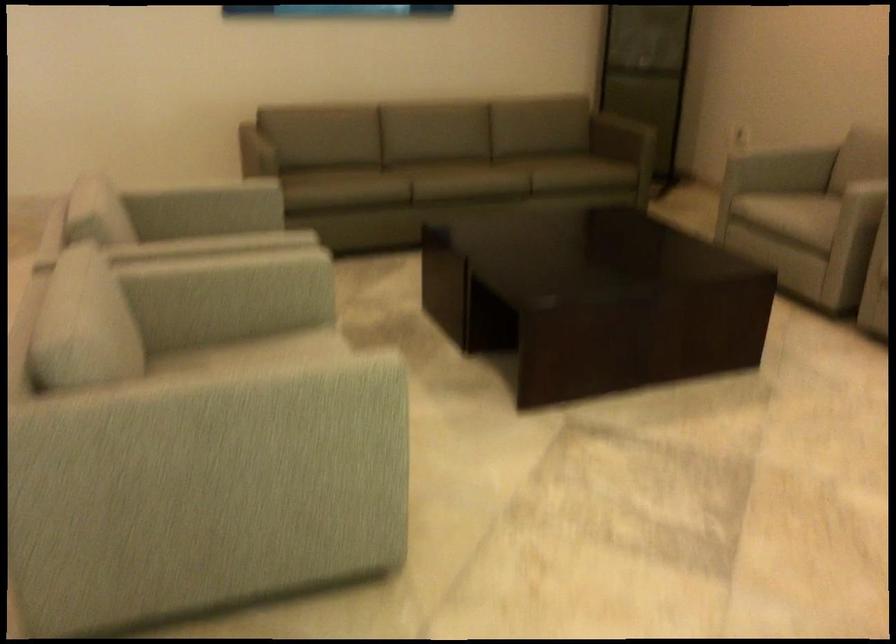
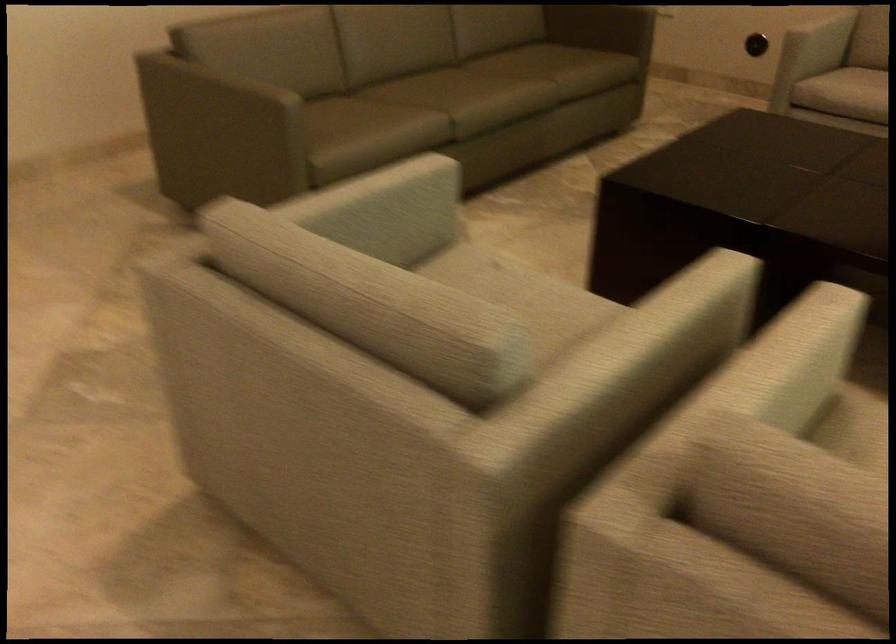
The point at (201, 267) is marked in the first image. Where is the corresponding point in the second image?

(782, 366)